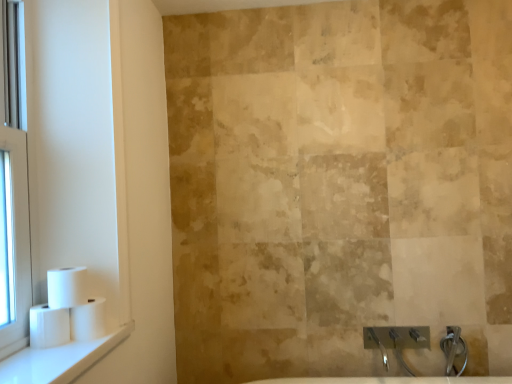
Question: From a real-world perspective, relative to white plastic toilet paper rolls at left, is white glossy window sill at lower left vertically above or below?

Choices:
 (A) below
 (B) above

Answer: (A)

Question: Which is correct: white glossy window sill at lower left is inside white plastic toilet paper rolls at left, or outside of it?

Choices:
 (A) outside
 (B) inside

Answer: (A)

Question: Which object is the closest to the clear glass window at left?

Choices:
 (A) white glossy window sill at lower left
 (B) white matte toilet paper at left, which ranks as the 1th toilet paper in right-to-left order
 (C) white plastic toilet paper rolls at left
 (D) white matte toilet paper at left, which is counted as the 2th toilet paper, starting from the left
 (E) white matte toilet paper at left, the 3th toilet paper viewed from the right

Answer: (C)

Question: Which of these objects is positioned closest to the white glossy window sill at lower left?

Choices:
 (A) white matte toilet paper at left, which ranks as the 1th toilet paper in left-to-right order
 (B) white matte toilet paper at left, which ranks as the 1th toilet paper in right-to-left order
 (C) white plastic toilet paper rolls at left
 (D) clear glass window at left
 (E) white matte toilet paper at left, the second toilet paper positioned from the right

Answer: (A)